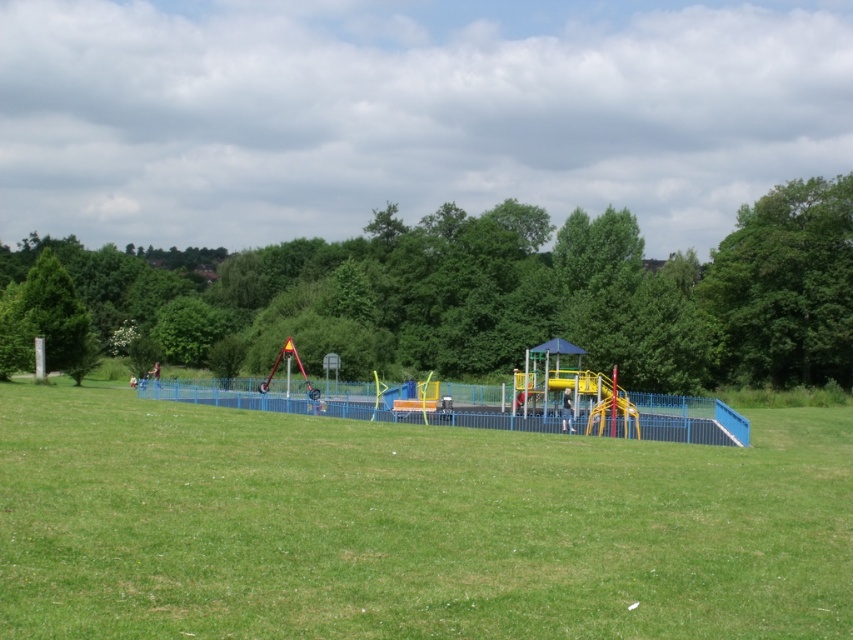
Question: Which object is the closest to the green leafy tree at upper right?

Choices:
 (A) metallic blue playground at center
 (B) green leafy tree at center
 (C) green leafy tree at left
 (D) green grassy field at center

Answer: (A)

Question: Estimate the real-world distances between objects in this image. Which object is farther from the green leafy tree at upper right?

Choices:
 (A) green leafy tree at left
 (B) metallic blue playground at center

Answer: (A)

Question: Based on their relative distances, which object is nearer to the green grassy field at center?

Choices:
 (A) metallic blue playground at center
 (B) green leafy tree at upper right
 (C) green leafy tree at center
 (D) green leafy tree at left

Answer: (A)

Question: Does green grassy field at center come in front of green leafy tree at upper right?

Choices:
 (A) no
 (B) yes

Answer: (B)

Question: From the image, what is the correct spatial relationship of green grassy field at center in relation to green leafy tree at left?

Choices:
 (A) right
 (B) left

Answer: (A)

Question: Does green leafy tree at center appear under green leafy tree at upper right?

Choices:
 (A) no
 (B) yes

Answer: (A)